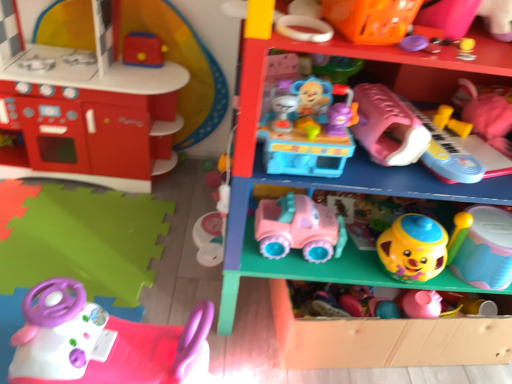
Find the location of a particular element. The image size is (512, 384). vacant space in front of matte red kitchen set at left, the 11th toy viewed from the right is located at coordinates (68, 229).